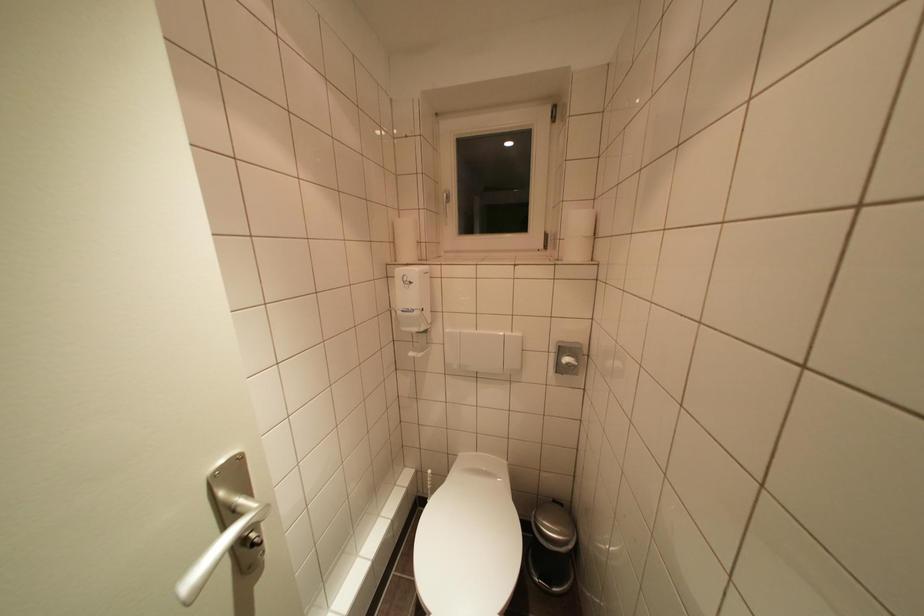
What do you see at coordinates (445, 204) in the screenshot? The image size is (924, 616). I see `the white window handle` at bounding box center [445, 204].